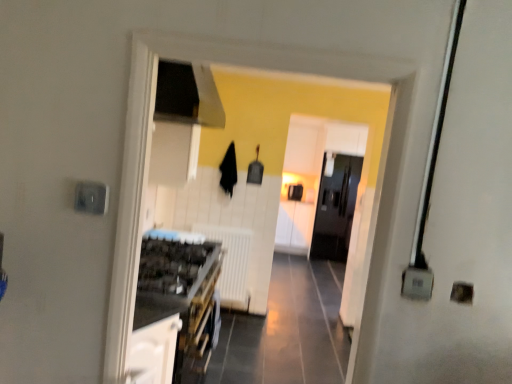
Measure the distance between point (319,244) and camera.

The distance of point (319,244) from camera is 5.98 meters.

Describe the element at coordinates (154, 351) in the screenshot. I see `white glossy cabinet at lower left, which is counted as the second cabinetry, starting from the right` at that location.

The image size is (512, 384). Find the location of `white glossy cabinet at center, which appears as the first cabinetry when viewed from the back`. white glossy cabinet at center, which appears as the first cabinetry when viewed from the back is located at coordinates (294, 227).

Between point (237, 286) and point (132, 357), which one is positioned behind?

The point (237, 286) is more distant.

Does white matte radiator at center have a greater width compared to white glossy cabinet at lower left, which is counted as the second cabinetry, starting from the right?

No.

Find the location of a particular element. The width and height of the screenshot is (512, 384). radiator lying on the right of white glossy cabinet at lower left, which is the 1th cabinetry from front to back is located at coordinates (231, 263).

Can you tell me how much white matte radiator at center and white glossy cabinet at lower left, positioned as the 1th cabinetry in left-to-right order, differ in facing direction?

90.4 degrees separate the facing orientations of white matte radiator at center and white glossy cabinet at lower left, positioned as the 1th cabinetry in left-to-right order.

Find the location of a particular element. door that is behind the white matte radiator at center is located at coordinates (336, 208).

Looking at this image, in terms of size, does white matte radiator at center appear bigger or smaller than black glossy refrigerator at center?

Clearly, white matte radiator at center is smaller in size than black glossy refrigerator at center.

From a real-world perspective, is white matte radiator at center physically below black glossy refrigerator at center?

Yes.

Based on the photo, which is more distant, (238, 242) or (329, 247)?

Point (329, 247)

Between white glossy cabinet at center, which appears as the 2th cabinetry when viewed from the front, and white matte radiator at center, which one has larger size?

white glossy cabinet at center, which appears as the 2th cabinetry when viewed from the front.

Considering the relative sizes of white glossy cabinet at center, which appears as the first cabinetry when viewed from the back, and white matte radiator at center in the image provided, is white glossy cabinet at center, which appears as the first cabinetry when viewed from the back, wider than white matte radiator at center?

Yes, white glossy cabinet at center, which appears as the first cabinetry when viewed from the back, is wider than white matte radiator at center.

From a real-world perspective, is white glossy cabinet at center, which appears as the 2th cabinetry when viewed from the front, positioned under white matte radiator at center based on gravity?

Yes, from a real-world perspective, white glossy cabinet at center, which appears as the 2th cabinetry when viewed from the front, is beneath white matte radiator at center.

Is white glossy cabinet at center, the 1th cabinetry viewed from the right, bigger than white glossy cabinet at lower left, which is counted as the second cabinetry, starting from the right?

Yes.

Between point (307, 242) and point (142, 352), which one is positioned behind?

The point (307, 242) is behind.

Is white glossy cabinet at center, the 1th cabinetry viewed from the right, looking in the opposite direction of white glossy cabinet at lower left, which is the 1th cabinetry from front to back?

No.

Is white glossy cabinet at center, the 1th cabinetry viewed from the right, positioned before white glossy cabinet at lower left, positioned as the 1th cabinetry in left-to-right order?

No, white glossy cabinet at center, the 1th cabinetry viewed from the right, is further to the viewer.

From the image's perspective, would you say white glossy cabinet at lower left, the second cabinetry positioned from the back, is positioned over white glossy cabinet at center, the 1th cabinetry viewed from the right?

No, from the image's perspective, white glossy cabinet at lower left, the second cabinetry positioned from the back, is not over white glossy cabinet at center, the 1th cabinetry viewed from the right.

Can you confirm if white glossy cabinet at lower left, positioned as the 1th cabinetry in left-to-right order, is thinner than white glossy cabinet at center, the 1th cabinetry viewed from the right?

In fact, white glossy cabinet at lower left, positioned as the 1th cabinetry in left-to-right order, might be wider than white glossy cabinet at center, the 1th cabinetry viewed from the right.

Does point (167, 326) lie behind point (312, 229)?

No, (167, 326) is closer to viewer.

Are white glossy cabinet at center, which appears as the first cabinetry when viewed from the back, and black glossy refrigerator at center far apart?

white glossy cabinet at center, which appears as the first cabinetry when viewed from the back, is actually quite close to black glossy refrigerator at center.

Consider the image. From a real-world perspective, is white glossy cabinet at center, which appears as the first cabinetry when viewed from the back, above or below black glossy refrigerator at center?

white glossy cabinet at center, which appears as the first cabinetry when viewed from the back, is situated lower than black glossy refrigerator at center in the real world.

From the image's perspective, between white glossy cabinet at center, which appears as the first cabinetry when viewed from the back, and black glossy refrigerator at center, who is located below?

white glossy cabinet at center, which appears as the first cabinetry when viewed from the back, from the image's perspective.

In terms of height, does white glossy cabinet at center, the second cabinetry in the left-to-right sequence, look taller or shorter compared to black glossy refrigerator at center?

Clearly, white glossy cabinet at center, the second cabinetry in the left-to-right sequence, is shorter compared to black glossy refrigerator at center.

From their relative heights in the image, would you say white matte radiator at center is taller or shorter than white glossy cabinet at center, which appears as the first cabinetry when viewed from the back?

white matte radiator at center is shorter than white glossy cabinet at center, which appears as the first cabinetry when viewed from the back.

Is white matte radiator at center bigger or smaller than white glossy cabinet at center, which appears as the first cabinetry when viewed from the back?

Considering their sizes, white matte radiator at center takes up less space than white glossy cabinet at center, which appears as the first cabinetry when viewed from the back.

Considering the positions of objects white matte radiator at center and white glossy cabinet at center, which appears as the 2th cabinetry when viewed from the front, in the image provided, who is more to the right, white matte radiator at center or white glossy cabinet at center, which appears as the 2th cabinetry when viewed from the front,?

From the viewer's perspective, white glossy cabinet at center, which appears as the 2th cabinetry when viewed from the front, appears more on the right side.

Considering the relative sizes of white matte radiator at center and white glossy cabinet at center, which appears as the 2th cabinetry when viewed from the front, in the image provided, is white matte radiator at center wider than white glossy cabinet at center, which appears as the 2th cabinetry when viewed from the front,?

No, white matte radiator at center is not wider than white glossy cabinet at center, which appears as the 2th cabinetry when viewed from the front.

Identify the location of cabinetry above the white matte radiator at center (from a real-world perspective). This screenshot has height=384, width=512. (154, 351).

Where is `radiator in front of the black glossy refrigerator at center`? This screenshot has height=384, width=512. radiator in front of the black glossy refrigerator at center is located at coordinates (x=231, y=263).

Looking at the image, which one is located closer to white glossy cabinet at center, which appears as the first cabinetry when viewed from the back, white matte radiator at center or white glossy cabinet at lower left, positioned as the 1th cabinetry in left-to-right order?

Based on the image, white matte radiator at center appears to be nearer to white glossy cabinet at center, which appears as the first cabinetry when viewed from the back.

From the image, which object appears to be farther from black glossy refrigerator at center, white glossy cabinet at lower left, which is counted as the second cabinetry, starting from the right, or white glossy cabinet at center, the second cabinetry in the left-to-right sequence?

Among the two, white glossy cabinet at lower left, which is counted as the second cabinetry, starting from the right, is located further to black glossy refrigerator at center.

Which object lies further to the anchor point white matte radiator at center, black glossy refrigerator at center or white glossy cabinet at lower left, which is counted as the second cabinetry, starting from the right?

white glossy cabinet at lower left, which is counted as the second cabinetry, starting from the right, is positioned further to the anchor white matte radiator at center.

When comparing their distances from white matte radiator at center, does black glossy refrigerator at center or white glossy cabinet at center, which appears as the first cabinetry when viewed from the back, seem further?

The object further to white matte radiator at center is white glossy cabinet at center, which appears as the first cabinetry when viewed from the back.

In the scene shown: When comparing their distances from white glossy cabinet at lower left, which is the 1th cabinetry from front to back, does white glossy cabinet at center, which appears as the 2th cabinetry when viewed from the front, or black glossy refrigerator at center seem further?

white glossy cabinet at center, which appears as the 2th cabinetry when viewed from the front, is positioned further to the anchor white glossy cabinet at lower left, which is the 1th cabinetry from front to back.

Which object lies further to the anchor point black glossy refrigerator at center, white matte radiator at center or white glossy cabinet at lower left, which is the 1th cabinetry from front to back?

The object further to black glossy refrigerator at center is white glossy cabinet at lower left, which is the 1th cabinetry from front to back.

From the image, which object appears to be nearer to white glossy cabinet at center, which appears as the 2th cabinetry when viewed from the front, black glossy refrigerator at center or white glossy cabinet at lower left, which is the 1th cabinetry from front to back?

Among the two, black glossy refrigerator at center is located nearer to white glossy cabinet at center, which appears as the 2th cabinetry when viewed from the front.

Which object lies nearer to the anchor point white glossy cabinet at lower left, the second cabinetry positioned from the back, black glossy refrigerator at center or white glossy cabinet at center, the second cabinetry in the left-to-right sequence?

A: black glossy refrigerator at center is positioned closer to the anchor white glossy cabinet at lower left, the second cabinetry positioned from the back.

Where is `door located between white matte radiator at center and white glossy cabinet at center, which appears as the 2th cabinetry when viewed from the front, in the depth direction`? The height and width of the screenshot is (384, 512). door located between white matte radiator at center and white glossy cabinet at center, which appears as the 2th cabinetry when viewed from the front, in the depth direction is located at coordinates (336, 208).

Where is `radiator between white glossy cabinet at lower left, positioned as the 1th cabinetry in left-to-right order, and black glossy refrigerator at center, along the z-axis`? The image size is (512, 384). radiator between white glossy cabinet at lower left, positioned as the 1th cabinetry in left-to-right order, and black glossy refrigerator at center, along the z-axis is located at coordinates (231, 263).

At what (x,y) coordinates should I click in order to perform the action: click on door located between white glossy cabinet at lower left, which is counted as the second cabinetry, starting from the right, and white glossy cabinet at center, which appears as the first cabinetry when viewed from the back, in the depth direction. Please return your answer as a coordinate pair (x, y). The image size is (512, 384). Looking at the image, I should click on (336, 208).

Where is `radiator between white glossy cabinet at lower left, positioned as the 1th cabinetry in left-to-right order, and white glossy cabinet at center, the 1th cabinetry viewed from the right, in the front-back direction`? The image size is (512, 384). radiator between white glossy cabinet at lower left, positioned as the 1th cabinetry in left-to-right order, and white glossy cabinet at center, the 1th cabinetry viewed from the right, in the front-back direction is located at coordinates (231, 263).